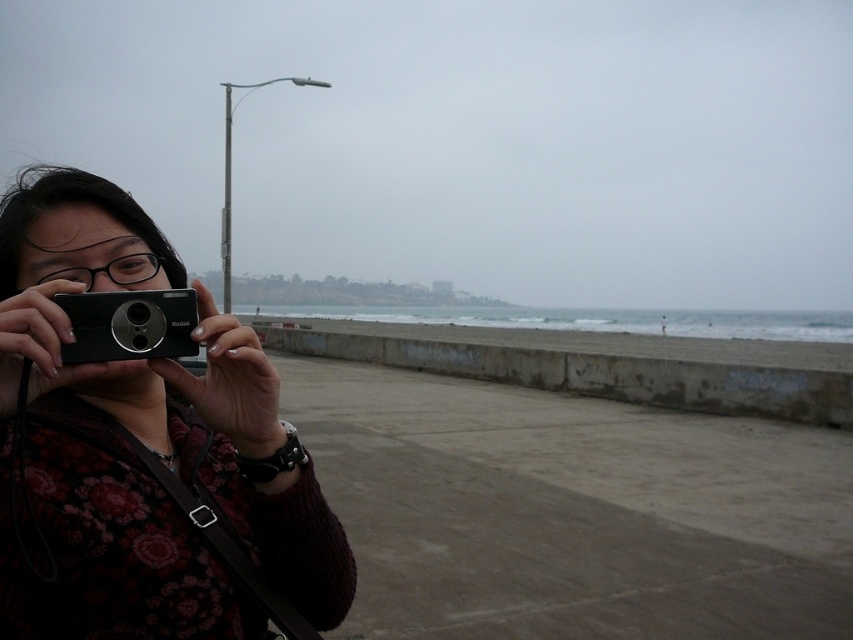
Question: Where is matte black camera at left located in relation to black plastic camera at left in the image?

Choices:
 (A) below
 (B) above

Answer: (B)

Question: Does matte black camera at left appear on the right side of black plastic camera at left?

Choices:
 (A) yes
 (B) no

Answer: (B)

Question: Is matte black camera at left above black plastic camera at left?

Choices:
 (A) no
 (B) yes

Answer: (B)

Question: Among these points, which one is farthest from the camera?

Choices:
 (A) (305, 492)
 (B) (82, 298)

Answer: (A)

Question: Which of the following is the closest to the observer?

Choices:
 (A) (194, 300)
 (B) (280, 480)

Answer: (A)